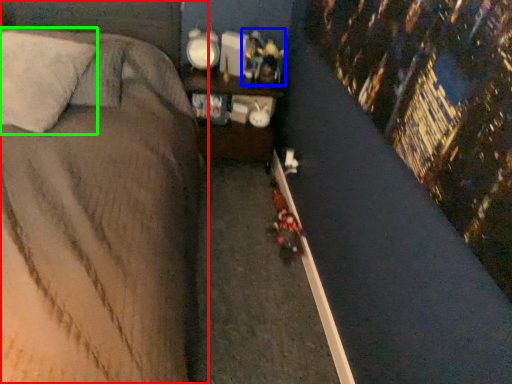
Question: Which object is positioned farthest from bed (highlighted by a red box)? Select from toy (highlighted by a blue box) and pillow (highlighted by a green box).

Choices:
 (A) toy
 (B) pillow

Answer: (A)